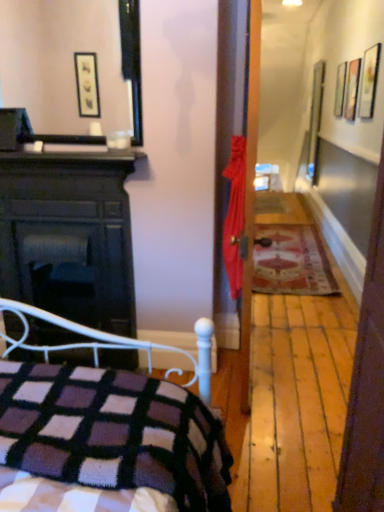
The height and width of the screenshot is (512, 384). Identify the location of free spot above carpeted mat at hallway center (from a real-world perspective). (297, 265).